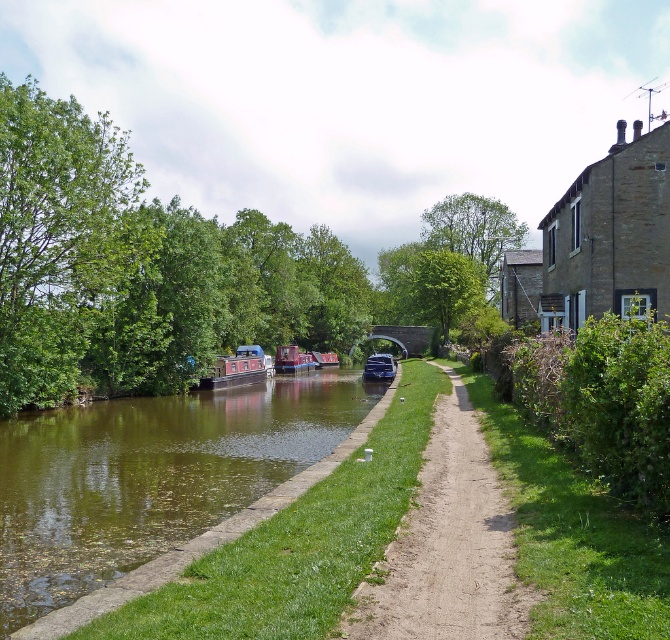
Who is more distant from viewer, (275, 429) or (299, 362)?

The point (299, 362) is more distant.

Based on the photo, is green smooth water at center in front of matte blue boat at center?

Yes, green smooth water at center is closer to the viewer.

The image size is (670, 640). I want to click on green smooth water at center, so click(155, 486).

Where is `green smooth water at center`? Image resolution: width=670 pixels, height=640 pixels. green smooth water at center is located at coordinates 155,486.

Does matte red canal boat at center appear under matte blue boat at center?

No, matte red canal boat at center is not below matte blue boat at center.

Who is lower down, matte red canal boat at center or matte blue boat at center?

matte blue boat at center is lower down.

Where is `matte red canal boat at center`? matte red canal boat at center is located at coordinates (237, 369).

Which is above, green grass at center or matte red canal boat at center?

matte red canal boat at center is higher up.

Is point (462, 461) positioned in front of point (265, 369)?

That is True.

Locate an element on the screen. The width and height of the screenshot is (670, 640). green grass at center is located at coordinates (448, 545).